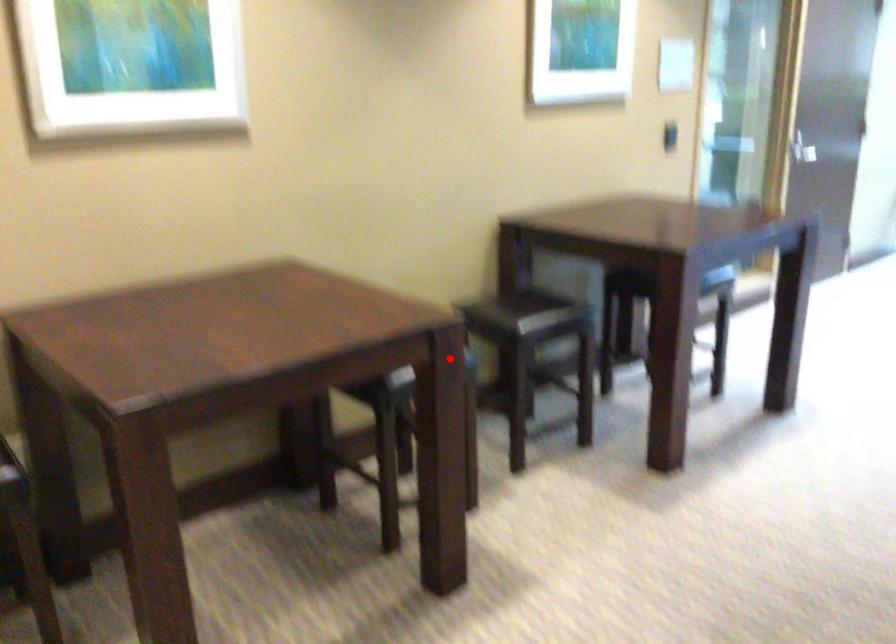
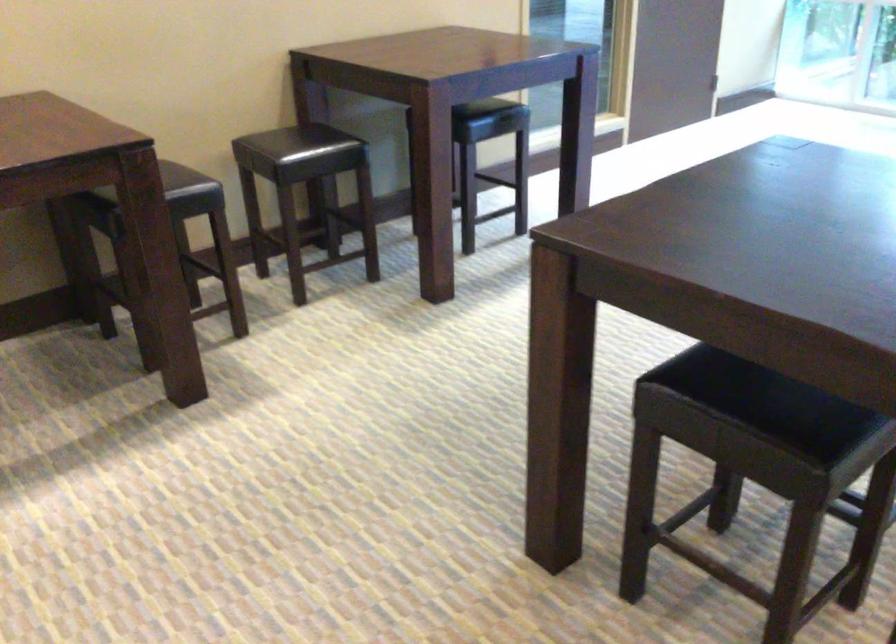
In the second image, find the point that corresponds to the highlighted location in the first image.

(168, 182)